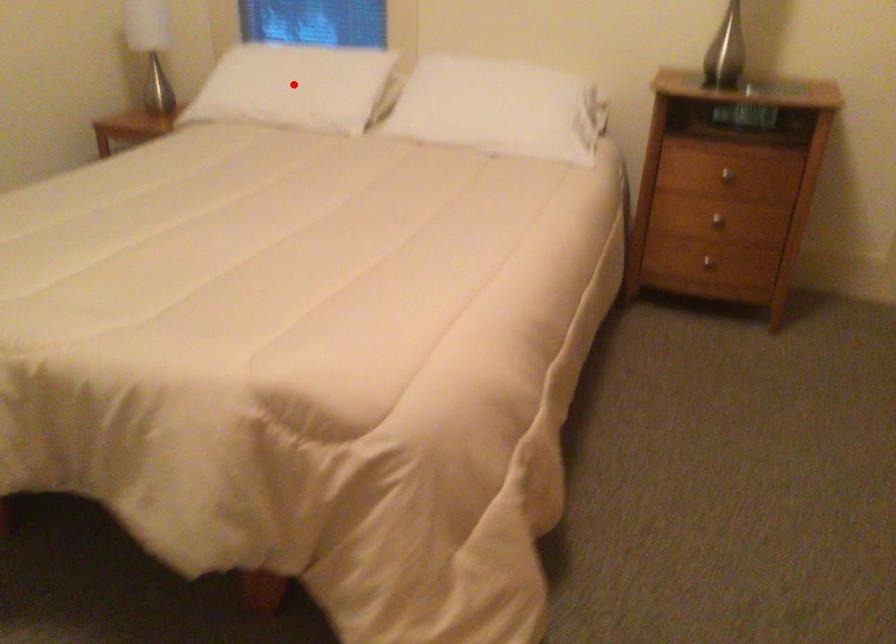
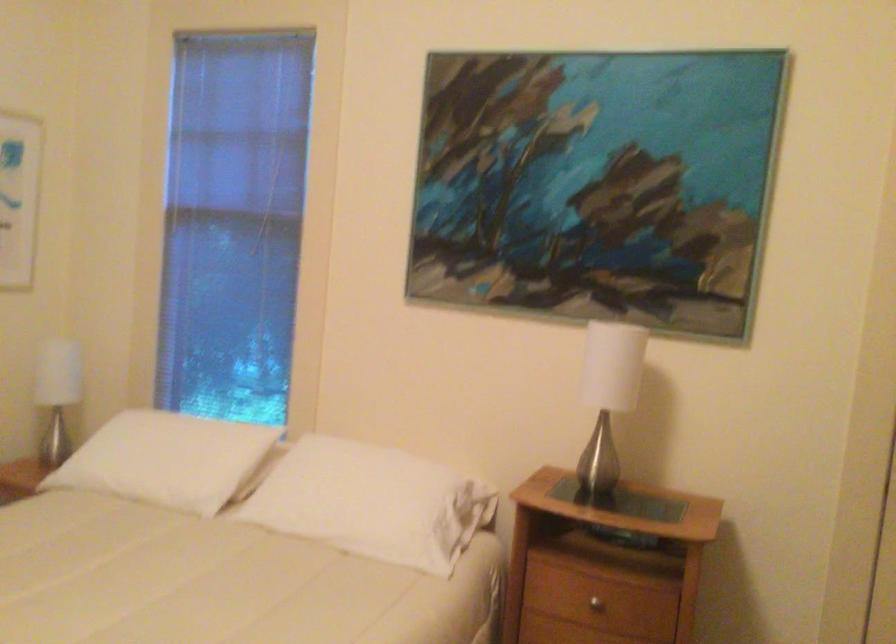
Locate, in the second image, the point that corresponds to the highlighted location in the first image.

(167, 459)